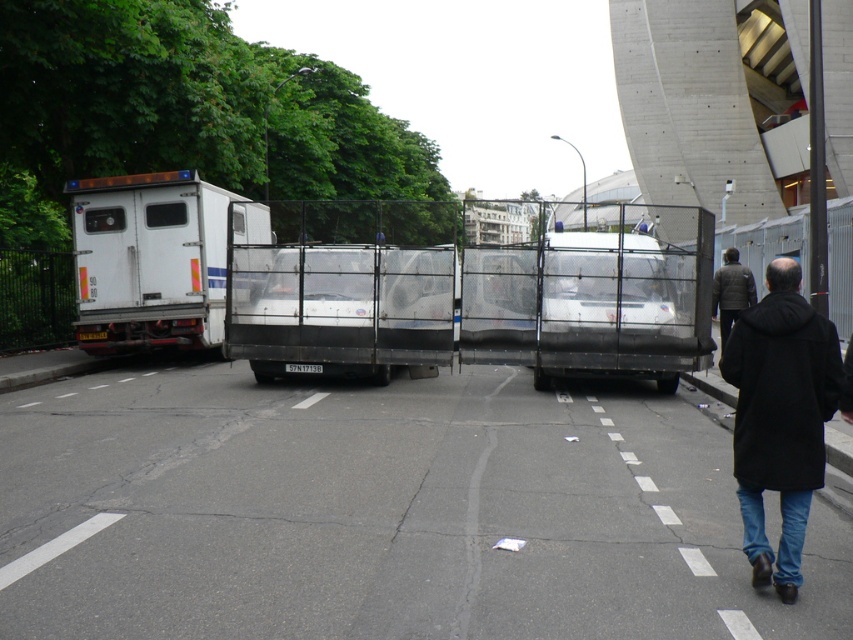
Question: Which of the following is the farthest from the observer?

Choices:
 (A) white matte truck at left
 (B) brown textured jacket at center right
 (C) black matte coat at lower right

Answer: (A)

Question: From the image, what is the correct spatial relationship of metallic silver trailer truck at center in relation to brown textured jacket at center right?

Choices:
 (A) left
 (B) right

Answer: (A)

Question: Which point is farther from the camera taking this photo?

Choices:
 (A) (277, 276)
 (B) (99, 180)
 (C) (834, 352)

Answer: (B)

Question: Does white matte truck at left come behind black matte coat at lower right?

Choices:
 (A) no
 (B) yes

Answer: (B)

Question: Which point is farther from the camera taking this photo?

Choices:
 (A) (746, 296)
 (B) (291, 358)
 (C) (822, 477)

Answer: (A)

Question: Observing the image, what is the correct spatial positioning of white matte truck at left in reference to black matte coat at lower right?

Choices:
 (A) right
 (B) left

Answer: (B)